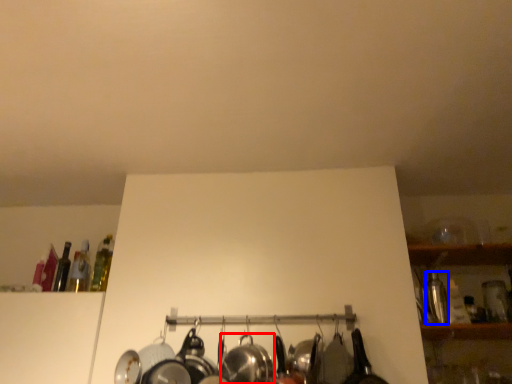
Question: Which point is further to the camera, wok (highlighted by a red box) or bottle (highlighted by a blue box)?

Choices:
 (A) wok
 (B) bottle

Answer: (B)